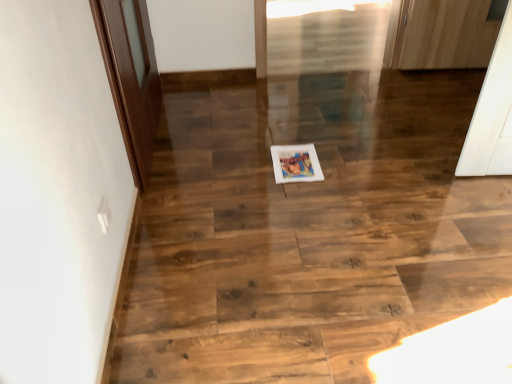
Question: Does brown wooden door at left lie in front of wooden floor at center?

Choices:
 (A) no
 (B) yes

Answer: (A)

Question: Does brown wooden door at left appear on the right side of wooden floor at center?

Choices:
 (A) yes
 (B) no

Answer: (B)

Question: From the image's perspective, is brown wooden door at left below wooden floor at center?

Choices:
 (A) yes
 (B) no

Answer: (B)

Question: Does brown wooden door at left have a lesser height compared to wooden floor at center?

Choices:
 (A) yes
 (B) no

Answer: (B)

Question: Is brown wooden door at left outside wooden floor at center?

Choices:
 (A) yes
 (B) no

Answer: (A)

Question: Is wooden floor at center wider or thinner than brown wooden door at left?

Choices:
 (A) wide
 (B) thin

Answer: (A)

Question: From a real-world perspective, is wooden floor at center physically located above or below brown wooden door at left?

Choices:
 (A) above
 (B) below

Answer: (B)

Question: Would you say wooden floor at center is inside or outside brown wooden door at left?

Choices:
 (A) outside
 (B) inside

Answer: (A)

Question: From the image's perspective, is wooden floor at center positioned above or below brown wooden door at left?

Choices:
 (A) above
 (B) below

Answer: (B)

Question: From their relative heights in the image, would you say brown wooden door at left is taller or shorter than wooden floor at center?

Choices:
 (A) tall
 (B) short

Answer: (A)

Question: Looking at the image, does brown wooden door at left seem bigger or smaller compared to wooden floor at center?

Choices:
 (A) small
 (B) big

Answer: (B)

Question: From a real-world perspective, relative to wooden floor at center, is brown wooden door at left vertically above or below?

Choices:
 (A) below
 (B) above

Answer: (B)

Question: In the image, is brown wooden door at left positioned in front of or behind wooden floor at center?

Choices:
 (A) front
 (B) behind

Answer: (B)

Question: In terms of height, does wooden floor at center look taller or shorter compared to matte paper postcard at center?

Choices:
 (A) tall
 (B) short

Answer: (A)

Question: Is point (283, 198) closer or farther from the camera than point (301, 158)?

Choices:
 (A) closer
 (B) farther

Answer: (A)